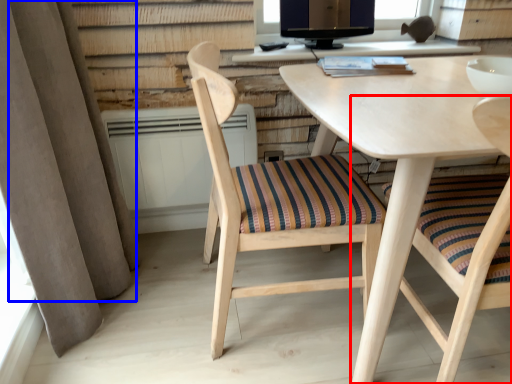
Question: Which object is further to the camera taking this photo, chair (highlighted by a red box) or curtain (highlighted by a blue box)?

Choices:
 (A) chair
 (B) curtain

Answer: (B)